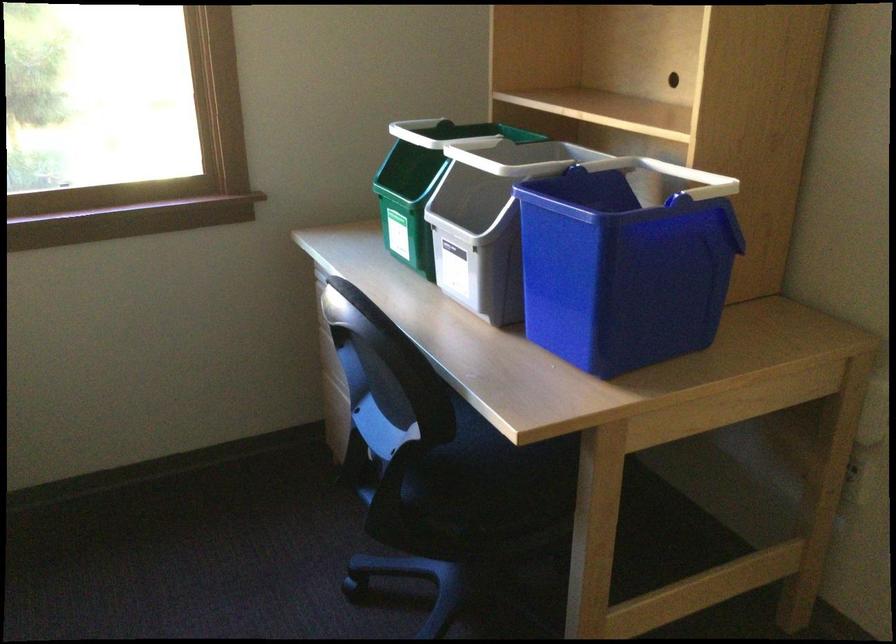
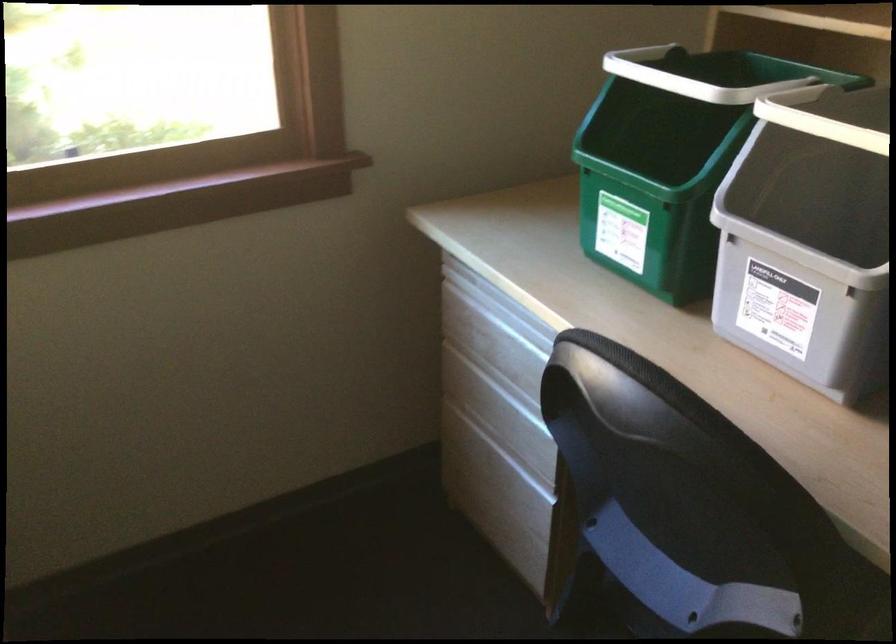
In a continuous first-person perspective shot, in which direction is the camera moving?

The cameraman moved toward left, forward.